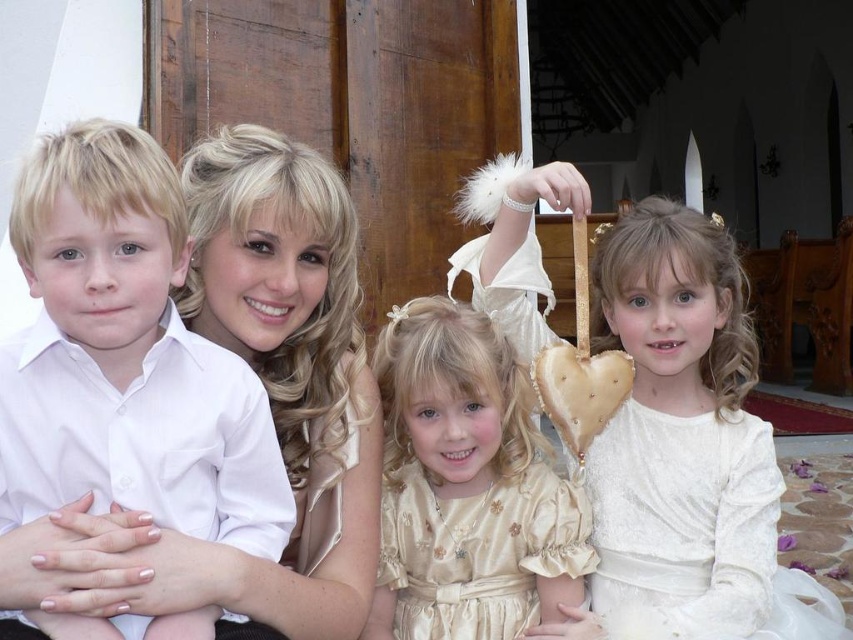
Question: Based on their relative distances, which object is nearer to the matte gold heart at center?

Choices:
 (A) gold satin dress at center
 (B) white satin shirt at left
 (C) white satin dress at lower right

Answer: (C)

Question: Can you confirm if white satin shirt at left is smaller than white satin dress at lower right?

Choices:
 (A) yes
 (B) no

Answer: (A)

Question: Which object appears closest to the camera in this image?

Choices:
 (A) white satin dress at lower right
 (B) gold satin dress at center
 (C) white satin shirt at left
 (D) matte gold heart at center

Answer: (C)

Question: Which object appears farthest from the camera in this image?

Choices:
 (A) matte gold heart at center
 (B) white satin dress at lower right
 (C) gold satin dress at center

Answer: (C)

Question: Is matte gold heart at center to the left of gold satin dress at center from the viewer's perspective?

Choices:
 (A) yes
 (B) no

Answer: (B)

Question: Is matte gold heart at center above white satin shirt at left?

Choices:
 (A) yes
 (B) no

Answer: (B)